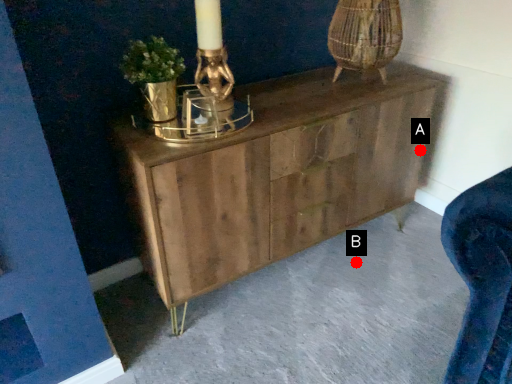
Question: Two points are circled on the image, labeled by A and B beside each circle. Which point appears farthest from the camera in this image?

Choices:
 (A) A is further
 (B) B is further

Answer: (B)